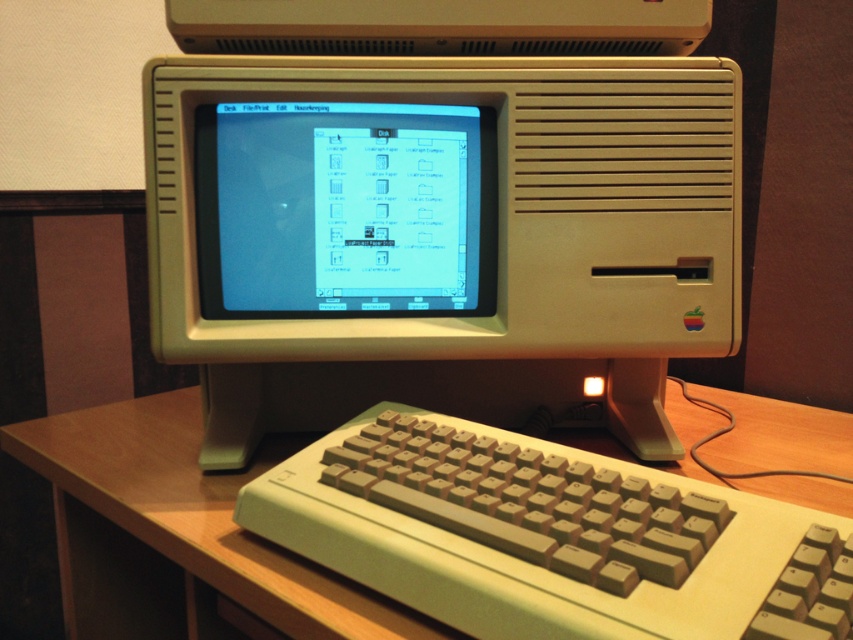
Does wooden at center lie in front of matte plastic screen at center?

Yes, it is.

Who is more distant from viewer, (695, 408) or (462, 234)?

Point (695, 408)

Locate an element on the screen. The width and height of the screenshot is (853, 640). wooden at center is located at coordinates (178, 532).

Which of these two, beige plastic desktop computer at center or matte plastic screen at center, stands taller?

beige plastic desktop computer at center is taller.

Does beige plastic desktop computer at center have a lesser height compared to matte plastic screen at center?

No, beige plastic desktop computer at center is not shorter than matte plastic screen at center.

Locate an element on the screen. beige plastic desktop computer at center is located at coordinates (440, 236).

Which of these two, beige plastic desktop computer at center or wooden at center, stands shorter?

wooden at center is shorter.

Who is lower down, beige plastic desktop computer at center or wooden at center?

wooden at center

You are a GUI agent. You are given a task and a screenshot of the screen. Output one action in this format:
    pyautogui.click(x=<x>, y=<y>)
    Task: Click on the beige plastic desktop computer at center
    The width and height of the screenshot is (853, 640).
    Given the screenshot: What is the action you would take?
    pyautogui.click(x=440, y=236)